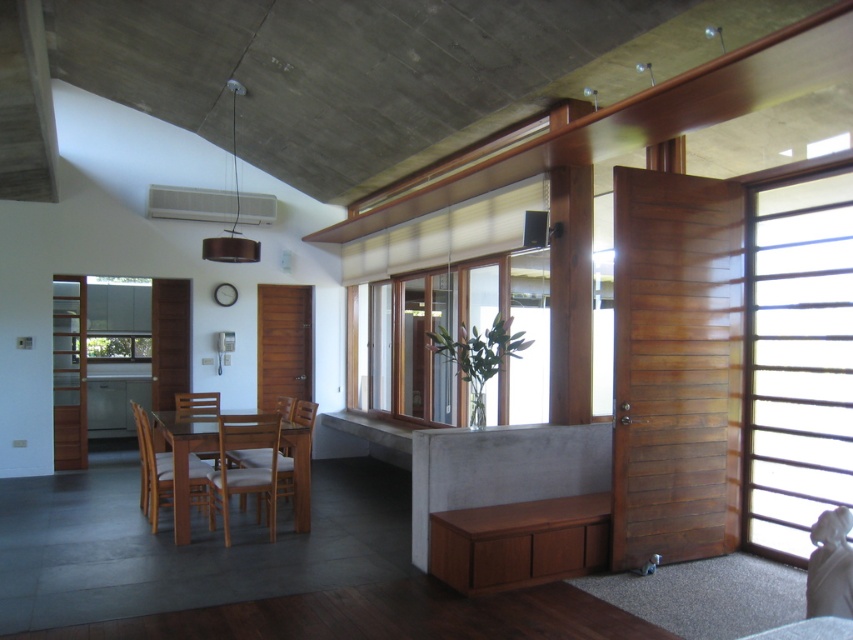
Can you confirm if light brown wooden table at center is positioned to the left of light brown wooden chair at center?

Yes, light brown wooden table at center is to the left of light brown wooden chair at center.

Does light brown wooden table at center have a lesser width compared to light brown wooden chair at center?

No, light brown wooden table at center is not thinner than light brown wooden chair at center.

What do you see at coordinates (183, 454) in the screenshot?
I see `light brown wooden table at center` at bounding box center [183, 454].

Locate an element on the screen. The height and width of the screenshot is (640, 853). light brown wooden table at center is located at coordinates (183, 454).

Does light brown wooden table at center appear over wooden chair at center?

Yes, light brown wooden table at center is above wooden chair at center.

Can you confirm if light brown wooden table at center is positioned to the left of wooden chair at center?

Incorrect, light brown wooden table at center is not on the left side of wooden chair at center.

Does point (186, 531) come in front of point (204, 500)?

Yes, it is.

The image size is (853, 640). Find the location of `light brown wooden table at center`. light brown wooden table at center is located at coordinates (183, 454).

Does wooden slats at right have a lesser height compared to light brown wooden chair at center?

Incorrect, wooden slats at right's height does not fall short of light brown wooden chair at center's.

Between wooden slats at right and light brown wooden chair at center, which one appears on the left side from the viewer's perspective?

light brown wooden chair at center

This screenshot has width=853, height=640. What do you see at coordinates (798, 358) in the screenshot? I see `wooden slats at right` at bounding box center [798, 358].

Find the location of a particular element. The image size is (853, 640). wooden slats at right is located at coordinates (798, 358).